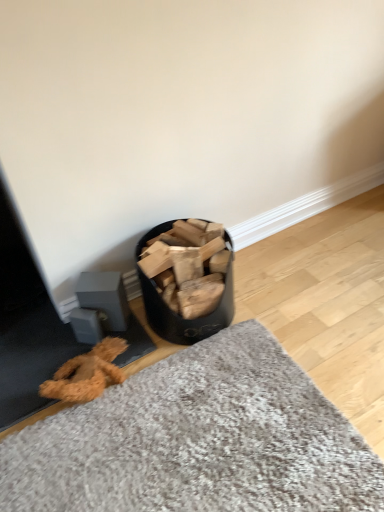
Where is `free space above textured gray mat at lower center (from a real-world perspective)`? Image resolution: width=384 pixels, height=512 pixels. free space above textured gray mat at lower center (from a real-world perspective) is located at coordinates (253, 355).